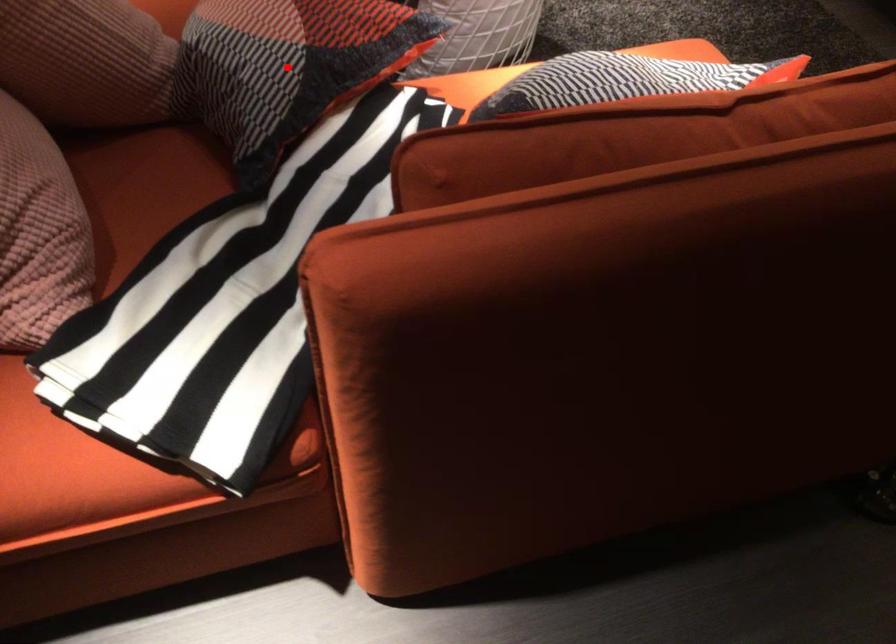
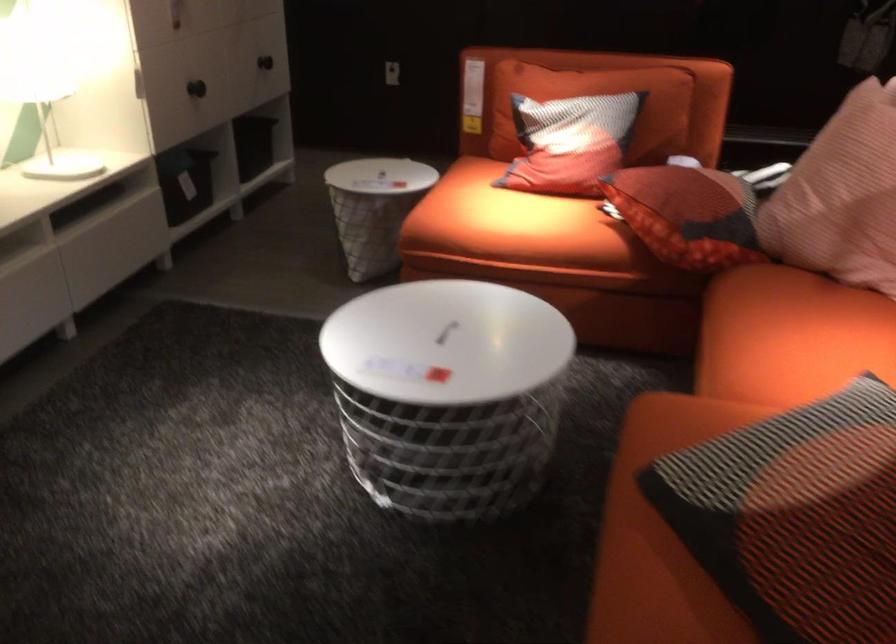
Question: I am providing you with two images of the same scene from different viewpoints. A red point is marked on the first image. Can you still see the location of the red point in image 2?

Choices:
 (A) Yes
 (B) No

Answer: (B)